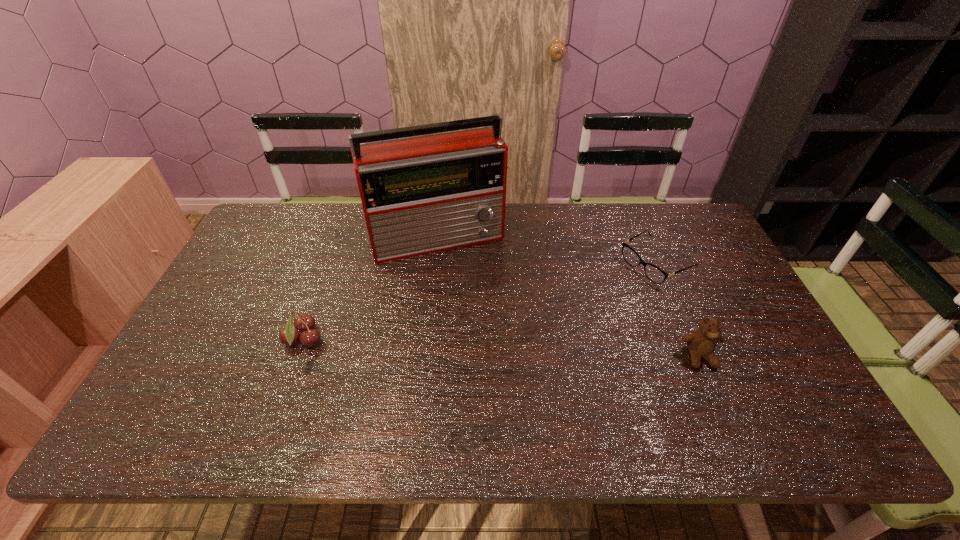
Find the location of a particular element. The width and height of the screenshot is (960, 540). free space located 0.090m on the front-facing side of the spectacles is located at coordinates (611, 289).

Locate an element on the screen. This screenshot has width=960, height=540. free space located 0.110m on the front-facing side of the tallest object is located at coordinates (467, 287).

Identify the location of free space located on the front-facing side of the tallest object. (481, 324).

In order to click on vacant space located on the front-facing side of the tallest object in this screenshot , I will do `click(478, 316)`.

Find the location of a particular element. The height and width of the screenshot is (540, 960). spectacles at the far edge is located at coordinates (655, 274).

Find the location of a particular element. radio receiver at the far edge is located at coordinates (425, 194).

I want to click on teddy bear situated at the right edge, so click(701, 343).

I want to click on spectacles at the right edge, so click(655, 274).

Where is `object at the far right corner`? object at the far right corner is located at coordinates [x=655, y=274].

Identify the location of free space at the far edge of the desktop. The width and height of the screenshot is (960, 540). (563, 208).